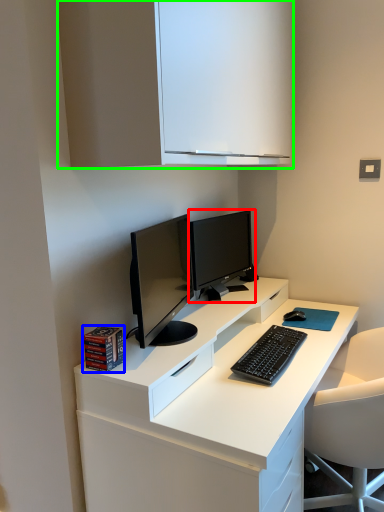
Question: Which object is the farthest from computer monitor (highlighted by a red box)? Choose among these: book (highlighted by a blue box) or cabinetry (highlighted by a green box).

Choices:
 (A) book
 (B) cabinetry

Answer: (A)